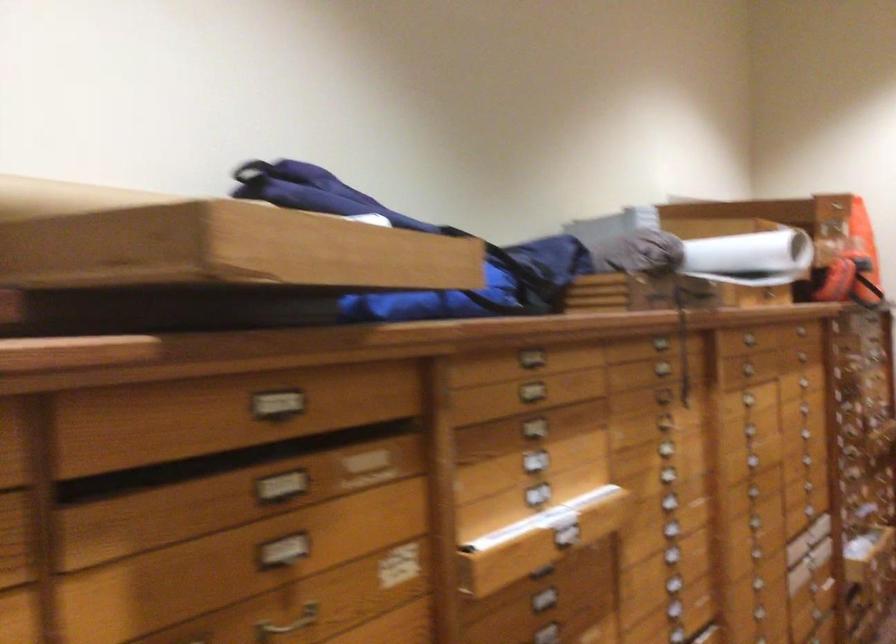
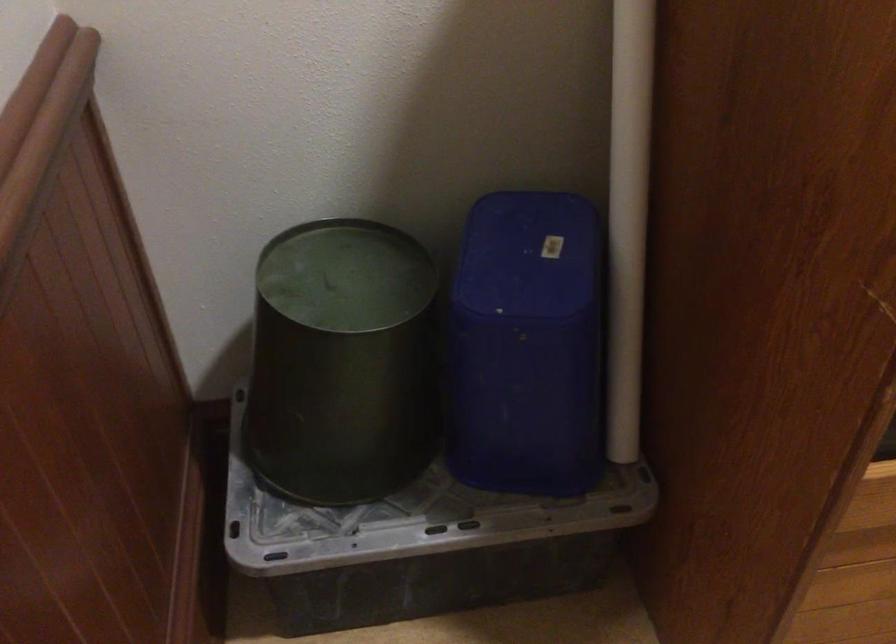
Based on the continuous images, in which direction is the camera rotating?

The rotation direction of the camera is left-down.